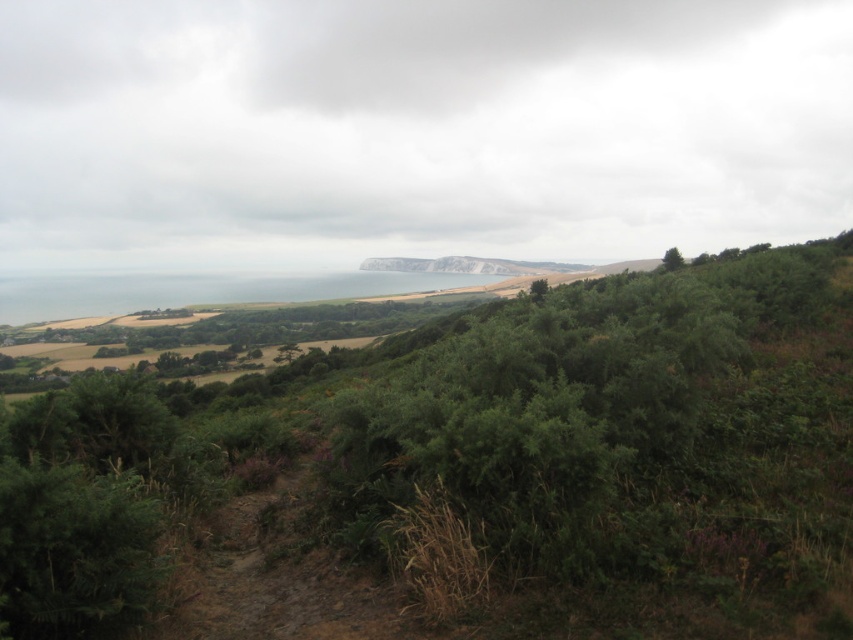
You are a hiker standing at the base of the green leafy tree at center. You want to walk towards the green leafy tree at upper right. Which direction should you head?

The green leafy tree at upper right is positioned on the right side of green leafy tree at center, so you should head towards the right direction.

From the picture: You are an environmental scientist assessing tree health in this landscape. You observe the green leafy tree at upper right and the green leafy tree at center. Which tree would you prioritize for further inspection if you suspect smaller trees might be more vulnerable to disease?

The green leafy tree at upper right should be prioritized for inspection because it has a smaller size compared to the green leafy tree at center, making it potentially more vulnerable to disease.